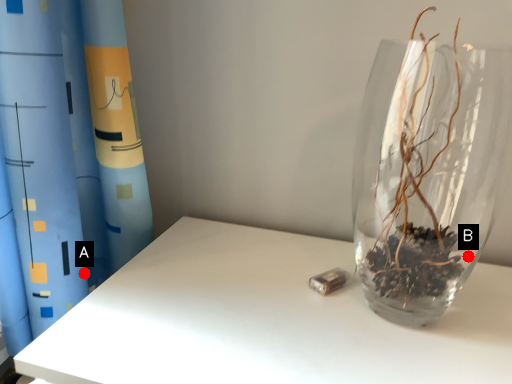
Question: Two points are circled on the image, labeled by A and B beside each circle. Among these points, which one is farthest from the camera?

Choices:
 (A) A is further
 (B) B is further

Answer: (B)